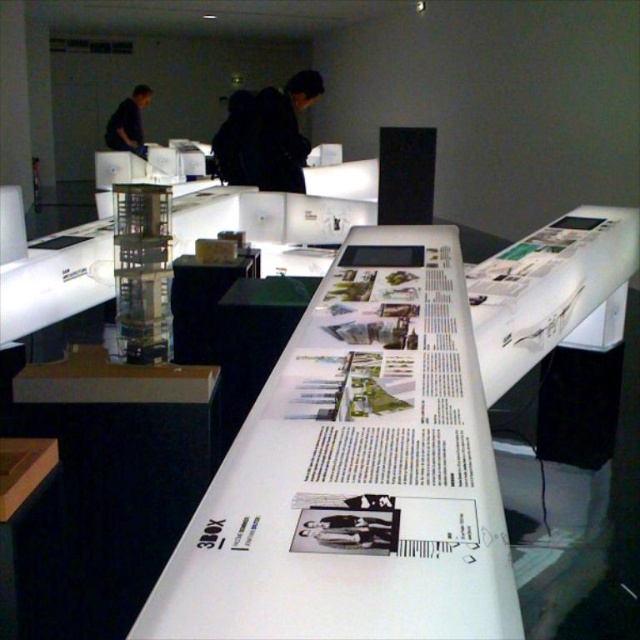
Question: Can you confirm if white glossy table at center is wider than dark blue shirt at upper left?

Choices:
 (A) yes
 (B) no

Answer: (A)

Question: Among these points, which one is farthest from the camera?

Choices:
 (A) (140, 84)
 (B) (349, 561)
 (C) (292, 113)

Answer: (A)

Question: Which of these objects is positioned closest to the dark blue shirt at upper left?

Choices:
 (A) white glossy table at center
 (B) black fabric at upper center

Answer: (B)

Question: Does white glossy table at center appear under dark blue shirt at upper left?

Choices:
 (A) no
 (B) yes

Answer: (B)

Question: From the image, what is the correct spatial relationship of black fabric at upper center in relation to dark blue shirt at upper left?

Choices:
 (A) left
 (B) right

Answer: (B)

Question: Which of the following is the closest to the observer?

Choices:
 (A) (260, 108)
 (B) (145, 156)
 (C) (300, 445)

Answer: (C)